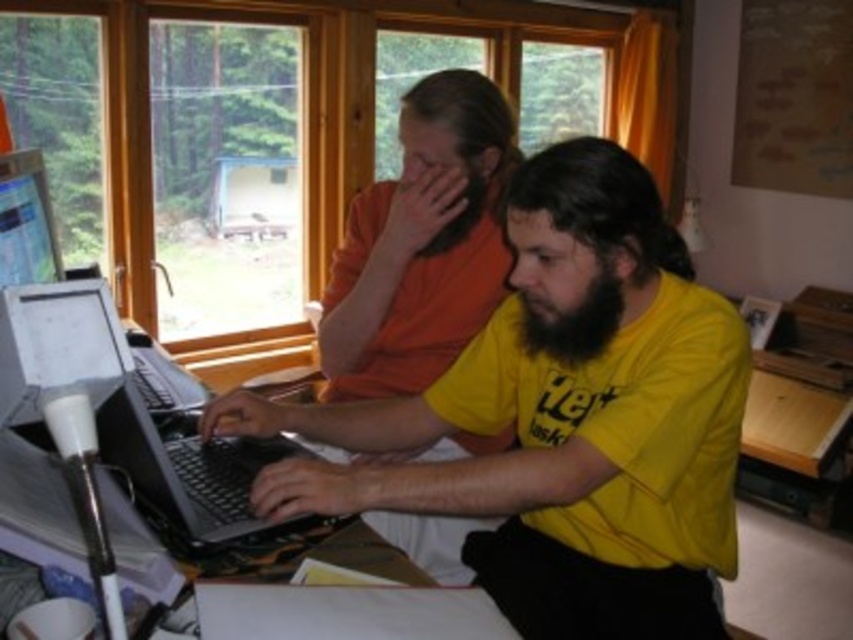
Question: Which point is farther to the camera?

Choices:
 (A) (460, 540)
 (B) (583, 314)
 (C) (653, 465)
 (D) (177, 444)

Answer: (A)

Question: Does orange matte shirt at center appear on the left side of black plastic laptop at left?

Choices:
 (A) no
 (B) yes

Answer: (A)

Question: Which point appears farthest from the camera in this image?

Choices:
 (A) (94, 342)
 (B) (521, 337)

Answer: (B)

Question: Which object appears farthest from the camera in this image?

Choices:
 (A) black plastic laptop at left
 (B) black fuzzy beard at center
 (C) orange matte shirt at center
 (D) yellow matte shirt at center

Answer: (C)

Question: Can you confirm if orange matte shirt at center is positioned to the right of black fuzzy beard at center?

Choices:
 (A) yes
 (B) no

Answer: (B)

Question: Can you confirm if yellow matte shirt at center is thinner than black plastic laptop at left?

Choices:
 (A) yes
 (B) no

Answer: (B)